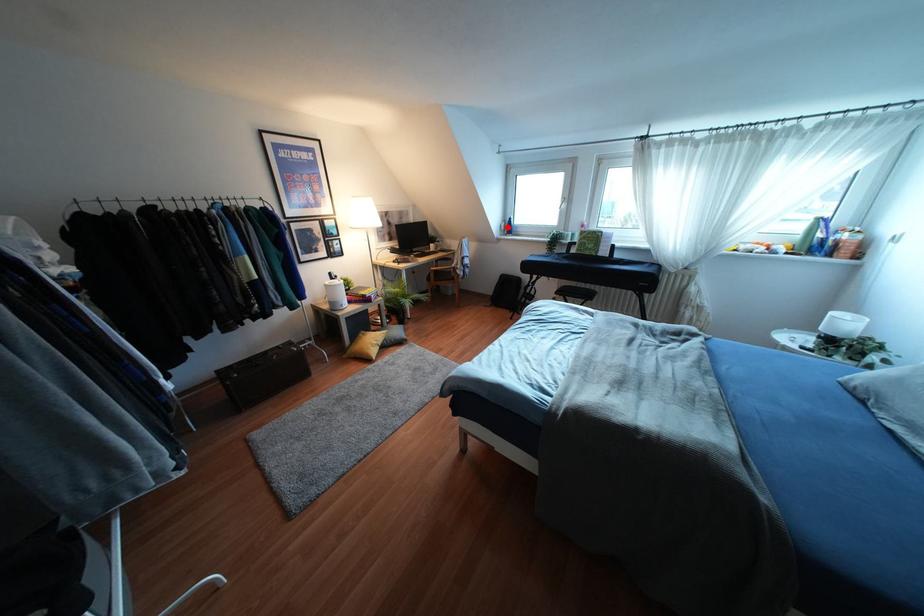
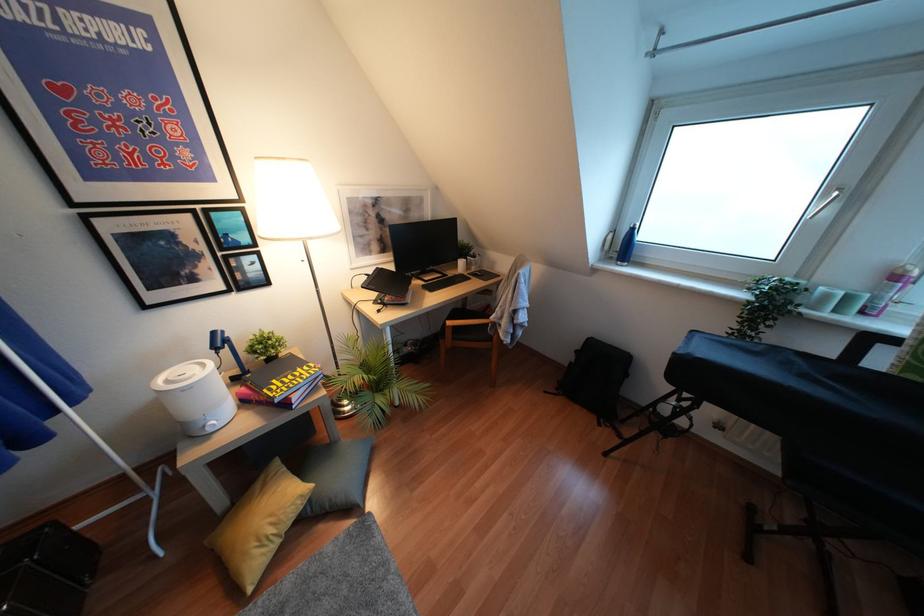
Question: I am providing you with two images of the same scene from different viewpoints. A red point is shown in image1. For the corresponding object point in image2, is it positioned nearer or farther from the camera?

Choices:
 (A) Nearer
 (B) Farther

Answer: (B)